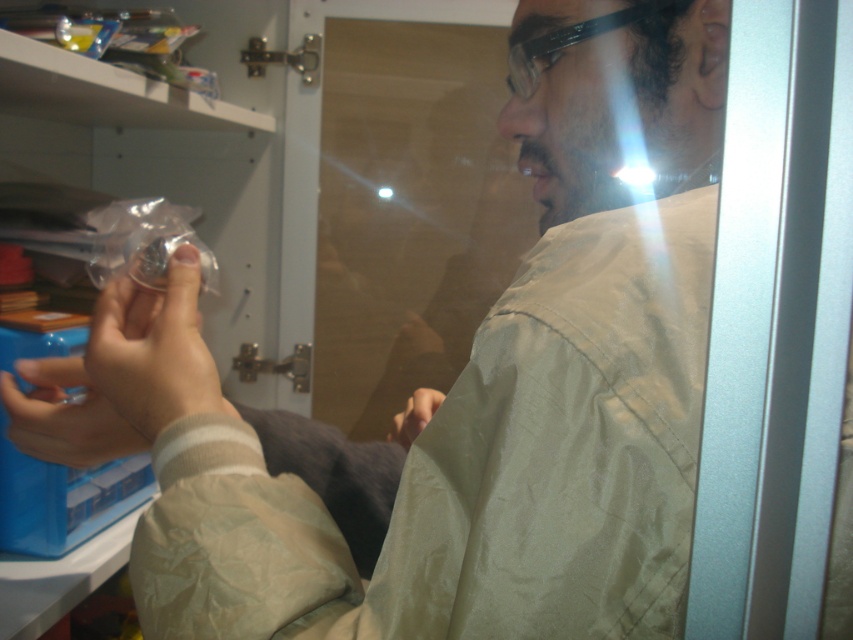
Question: Which of the following is the closest to the observer?

Choices:
 (A) clear plastic hand at center
 (B) smooth beige hand at lower center
 (C) matte plastic ring at center

Answer: (A)

Question: Which object is positioned farthest from the matte plastic ring at center?

Choices:
 (A) clear plastic hand at center
 (B) smooth beige hand at lower center

Answer: (B)

Question: Which point is closer to the camera?

Choices:
 (A) (103, 362)
 (B) (416, 426)
 (C) (51, 396)

Answer: (A)

Question: Is clear plastic hand at center thinner than matte plastic ring at center?

Choices:
 (A) no
 (B) yes

Answer: (B)

Question: Is matte plastic ring at center positioned before smooth beige hand at lower center?

Choices:
 (A) no
 (B) yes

Answer: (B)

Question: Is matte plastic ring at center below smooth beige hand at lower center?

Choices:
 (A) yes
 (B) no

Answer: (B)